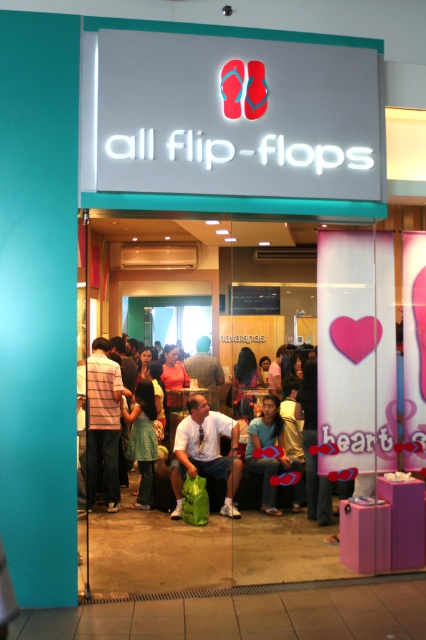
Between light blue denim jeans at center and blue denim jeans at center, which one is positioned higher?

light blue denim jeans at center is higher up.

Looking at this image, does light blue denim jeans at center appear over blue denim jeans at center?

Yes.

Does point (178, 476) lie behind point (299, 490)?

No, (178, 476) is in front of (299, 490).

This screenshot has height=640, width=426. Identify the location of light blue denim jeans at center. (109, 413).

Is light blue denim jeans at center above striped shirt at center?

No, light blue denim jeans at center is not above striped shirt at center.

Who is lower down, light blue denim jeans at center or striped shirt at center?

light blue denim jeans at center

Is point (172, 348) farther from camera compared to point (117, 493)?

Yes.

Locate an element on the screen. Image resolution: width=426 pixels, height=640 pixels. light blue denim jeans at center is located at coordinates (x=109, y=413).

Is striped shirt at center taller than matte green bag at center?

Indeed, striped shirt at center has a greater height compared to matte green bag at center.

Who is more forward, (100, 353) or (189, 404)?

Positioned in front is point (189, 404).

Which is in front, point (112, 470) or point (213, 419)?

Positioned in front is point (213, 419).

At what (x,y) coordinates should I click in order to perform the action: click on striped shirt at center. Please return your answer as a coordinate pair (x, y). This screenshot has width=426, height=640. Looking at the image, I should click on (103, 422).